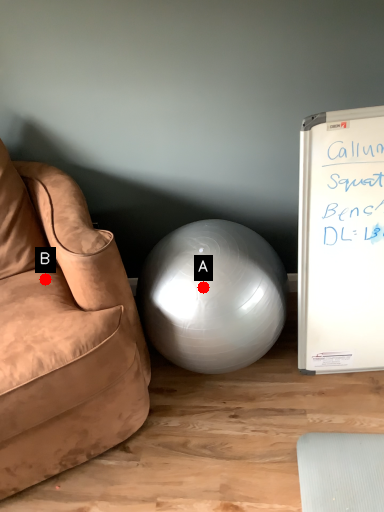
Question: Two points are circled on the image, labeled by A and B beside each circle. Among these points, which one is farthest from the camera?

Choices:
 (A) A is further
 (B) B is further

Answer: (B)